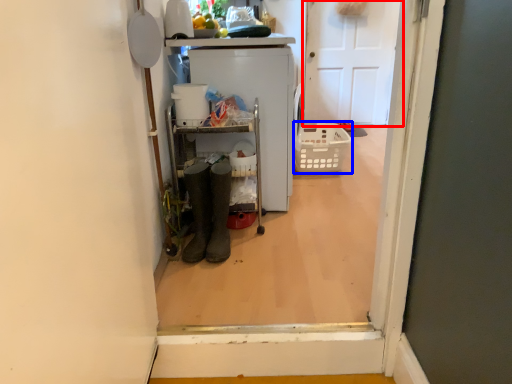
Question: Among these objects, which one is farthest to the camera, door (highlighted by a red box) or basket (highlighted by a blue box)?

Choices:
 (A) door
 (B) basket

Answer: (A)